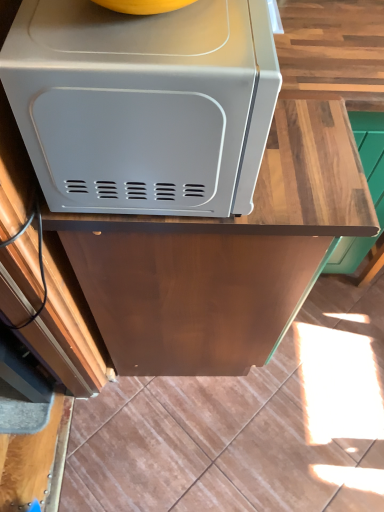
The image size is (384, 512). What are the coordinates of `free point in front of wooden at upper center` in the screenshot? It's located at (199, 434).